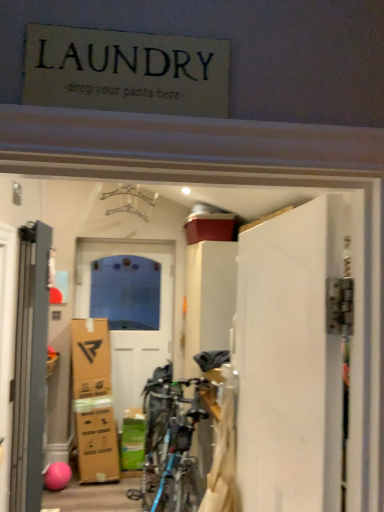
The image size is (384, 512). What do you see at coordinates (128, 307) in the screenshot? I see `white glossy door at center, placed as the first door when sorted from left to right` at bounding box center [128, 307].

Identify the location of white glossy door at center, marked as the 3th door in a right-to-left arrangement. (128, 307).

Looking at this image, between white matte door at right, which ranks as the 3th door in left-to-right order, and gray matte door at left, arranged as the second door when viewed from the back, which one appears on the right side from the viewer's perspective?

From the viewer's perspective, white matte door at right, which ranks as the 3th door in left-to-right order, appears more on the right side.

Considering the relative sizes of white matte door at right, arranged as the 1th door when viewed from the front, and gray matte door at left, which ranks as the 2th door in front-to-back order, in the image provided, is white matte door at right, arranged as the 1th door when viewed from the front, bigger than gray matte door at left, which ranks as the 2th door in front-to-back order,?

Indeed, white matte door at right, arranged as the 1th door when viewed from the front, has a larger size compared to gray matte door at left, which ranks as the 2th door in front-to-back order.

Starting from the white glossy door at center, acting as the 1th door starting from the back, which door is the 1st one to the right? Please provide its 2D coordinates.

[(30, 368)]

Looking at this image, is white glossy door at center, acting as the 1th door starting from the back, shorter than gray matte door at left, arranged as the second door when viewed from the back?

No, white glossy door at center, acting as the 1th door starting from the back, is not shorter than gray matte door at left, arranged as the second door when viewed from the back.

Is white glossy door at center, placed as the first door when sorted from left to right, not near gray matte door at left, which ranks as the 2th door in front-to-back order?

Yes, white glossy door at center, placed as the first door when sorted from left to right, and gray matte door at left, which ranks as the 2th door in front-to-back order, are located far from each other.

Between white glossy door at center, acting as the 1th door starting from the back, and gray matte door at left, arranged as the second door when viewed from the back, which one appears on the left side from the viewer's perspective?

From the viewer's perspective, white glossy door at center, acting as the 1th door starting from the back, appears more on the left side.

Does white matte door at right, placed as the 1th door when sorted from right to left, appear on the right side of white glossy door at center, marked as the 3th door in a right-to-left arrangement?

Yes, white matte door at right, placed as the 1th door when sorted from right to left, is to the right of white glossy door at center, marked as the 3th door in a right-to-left arrangement.

From a real-world perspective, is white matte door at right, which ranks as the 3th door in left-to-right order, physically above white glossy door at center, acting as the 1th door starting from the back?

Yes, from a real-world perspective, white matte door at right, which ranks as the 3th door in left-to-right order, is over white glossy door at center, acting as the 1th door starting from the back

In the scene shown: Is the depth of white matte door at right, arranged as the 1th door when viewed from the front, less than that of white glossy door at center, marked as the 3th door in a right-to-left arrangement?

Yes, white matte door at right, arranged as the 1th door when viewed from the front, is in front of white glossy door at center, marked as the 3th door in a right-to-left arrangement.

Is white matte door at right, arranged as the 1th door when viewed from the front, next to white glossy door at center, placed as the first door when sorted from left to right, and touching it?

No, white matte door at right, arranged as the 1th door when viewed from the front, is not next to white glossy door at center, placed as the first door when sorted from left to right.

You are a GUI agent. You are given a task and a screenshot of the screen. Output one action in this format:
    pyautogui.click(x=<x>, y=<y>)
    Task: Click on the door that is the 1st object located above the white glossy door at center, acting as the 1th door starting from the back (from the image's perspective)
    The height and width of the screenshot is (512, 384).
    Given the screenshot: What is the action you would take?
    pyautogui.click(x=30, y=368)

Is gray matte door at left, which ranks as the 2th door in front-to-back order, positioned beyond the bounds of white glossy door at center, acting as the 3th door starting from the front?

That's correct, gray matte door at left, which ranks as the 2th door in front-to-back order, is outside of white glossy door at center, acting as the 3th door starting from the front.

Which is in front, point (39, 347) or point (79, 317)?

Point (39, 347)

Considering the sizes of objects gray matte door at left, which is counted as the second door, starting from the right, and white glossy door at center, acting as the 1th door starting from the back, in the image provided, who is smaller, gray matte door at left, which is counted as the second door, starting from the right, or white glossy door at center, acting as the 1th door starting from the back,?

Smaller between the two is gray matte door at left, which is counted as the second door, starting from the right.

Considering the relative sizes of white glossy door at center, marked as the 3th door in a right-to-left arrangement, and white matte door at right, arranged as the 1th door when viewed from the front, in the image provided, is white glossy door at center, marked as the 3th door in a right-to-left arrangement, smaller than white matte door at right, arranged as the 1th door when viewed from the front,?

Actually, white glossy door at center, marked as the 3th door in a right-to-left arrangement, might be larger than white matte door at right, arranged as the 1th door when viewed from the front.

In the scene shown: Can you confirm if white glossy door at center, acting as the 1th door starting from the back, is thinner than white matte door at right, which ranks as the 3th door in left-to-right order?

In fact, white glossy door at center, acting as the 1th door starting from the back, might be wider than white matte door at right, which ranks as the 3th door in left-to-right order.

Is white glossy door at center, acting as the 3th door starting from the front, beside white matte door at right, which ranks as the 3th door in left-to-right order?

No, white glossy door at center, acting as the 3th door starting from the front, is not in contact with white matte door at right, which ranks as the 3th door in left-to-right order.

Considering the relative positions of white glossy door at center, acting as the 3th door starting from the front, and white matte door at right, marked as the third door in a back-to-front arrangement, in the image provided, is white glossy door at center, acting as the 3th door starting from the front, to the right of white matte door at right, marked as the third door in a back-to-front arrangement, from the viewer's perspective?

Incorrect, white glossy door at center, acting as the 3th door starting from the front, is not on the right side of white matte door at right, marked as the third door in a back-to-front arrangement.

Is gray matte door at left, which ranks as the 2th door in front-to-back order, beside white matte door at right, which ranks as the 3th door in left-to-right order?

gray matte door at left, which ranks as the 2th door in front-to-back order, and white matte door at right, which ranks as the 3th door in left-to-right order, are not in contact.

Where is `door to the right of gray matte door at left, arranged as the second door when viewed from the back`? The height and width of the screenshot is (512, 384). door to the right of gray matte door at left, arranged as the second door when viewed from the back is located at coordinates (289, 361).

How distant is gray matte door at left, which is counted as the second door, starting from the right, from white matte door at right, arranged as the 1th door when viewed from the front?

gray matte door at left, which is counted as the second door, starting from the right, is 93.23 centimeters from white matte door at right, arranged as the 1th door when viewed from the front.

Between point (43, 381) and point (300, 367), which one is positioned behind?

The point (43, 381) is behind.

Where is `the 1st door positioned below the white matte door at right, placed as the 1th door when sorted from right to left (from a real-world perspective)`? the 1st door positioned below the white matte door at right, placed as the 1th door when sorted from right to left (from a real-world perspective) is located at coordinates (30, 368).

Locate an element on the screen. The image size is (384, 512). door behind the gray matte door at left, which ranks as the 2th door in front-to-back order is located at coordinates 128,307.

Which object lies nearer to the anchor point gray matte door at left, which ranks as the 2th door in front-to-back order, white matte door at right, arranged as the 1th door when viewed from the front, or white glossy door at center, acting as the 1th door starting from the back?

Based on the image, white matte door at right, arranged as the 1th door when viewed from the front, appears to be nearer to gray matte door at left, which ranks as the 2th door in front-to-back order.

Looking at the image, which one is located further to white matte door at right, which ranks as the 3th door in left-to-right order, white glossy door at center, marked as the 3th door in a right-to-left arrangement, or gray matte door at left, arranged as the second door when viewed from the back?

white glossy door at center, marked as the 3th door in a right-to-left arrangement.

Looking at this image, when comparing their distances from gray matte door at left, arranged as the second door when viewed from the back, does white glossy door at center, marked as the 3th door in a right-to-left arrangement, or white matte door at right, placed as the 1th door when sorted from right to left, seem closer?

Based on the image, white matte door at right, placed as the 1th door when sorted from right to left, appears to be nearer to gray matte door at left, arranged as the second door when viewed from the back.

When comparing their distances from white glossy door at center, placed as the first door when sorted from left to right, does gray matte door at left, which ranks as the second door in left-to-right order, or white matte door at right, marked as the third door in a back-to-front arrangement, seem further?

white matte door at right, marked as the third door in a back-to-front arrangement, is further to white glossy door at center, placed as the first door when sorted from left to right.

Estimate the real-world distances between objects in this image. Which object is further from white glossy door at center, marked as the 3th door in a right-to-left arrangement, white matte door at right, arranged as the 1th door when viewed from the front, or gray matte door at left, arranged as the second door when viewed from the back?

white matte door at right, arranged as the 1th door when viewed from the front, is further to white glossy door at center, marked as the 3th door in a right-to-left arrangement.

When comparing their distances from white matte door at right, arranged as the 1th door when viewed from the front, does gray matte door at left, arranged as the second door when viewed from the back, or white glossy door at center, acting as the 1th door starting from the back, seem further?

Among the two, white glossy door at center, acting as the 1th door starting from the back, is located further to white matte door at right, arranged as the 1th door when viewed from the front.

Where is `door positioned between white matte door at right, which ranks as the 3th door in left-to-right order, and white glossy door at center, acting as the 1th door starting from the back, from near to far`? The height and width of the screenshot is (512, 384). door positioned between white matte door at right, which ranks as the 3th door in left-to-right order, and white glossy door at center, acting as the 1th door starting from the back, from near to far is located at coordinates (30, 368).